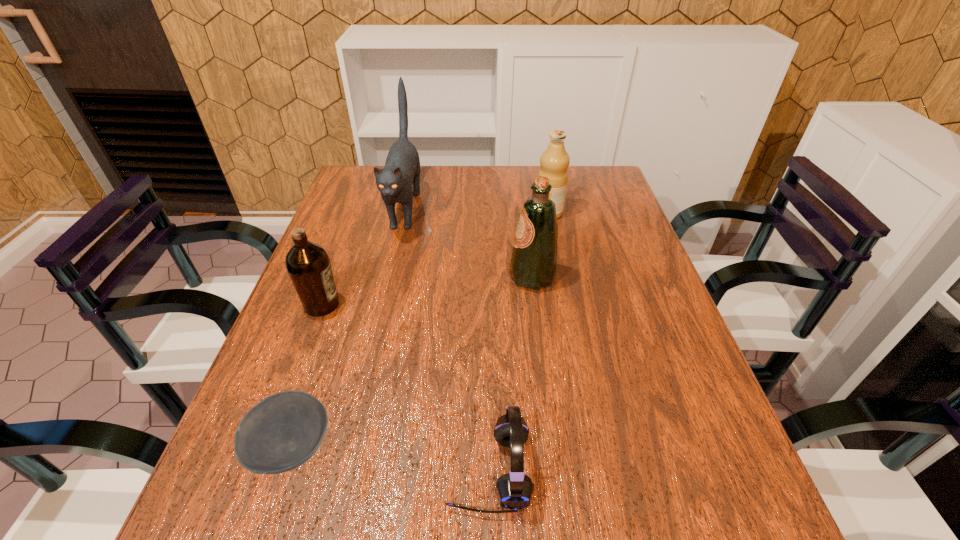
This screenshot has height=540, width=960. Find the location of `blank space located 0.320m on the label of the shortest olive oil`. blank space located 0.320m on the label of the shortest olive oil is located at coordinates pos(476,305).

Find the location of a particular element. The image size is (960, 540). free space located 0.270m on the ear cushions of the fifth tallest object is located at coordinates (289, 470).

Identify the location of blank space located 0.260m on the ear cushions of the fifth tallest object. (295, 470).

Where is `free location located on the ear cushions of the fifth tallest object`? The width and height of the screenshot is (960, 540). free location located on the ear cushions of the fifth tallest object is located at coordinates (419, 470).

At what (x,y) coordinates should I click in order to perform the action: click on vacant point located 0.260m on the right of the shortest object. Please return your answer as a coordinate pair (x, y). Looking at the image, I should click on (481, 447).

The height and width of the screenshot is (540, 960). I want to click on object that is at the far edge, so click(x=399, y=180).

This screenshot has width=960, height=540. In order to click on object that is positioned at the near edge in this screenshot , I will do `click(514, 490)`.

At what (x,y) coordinates should I click in order to perform the action: click on olive oil that is at the left edge. Please return your answer as a coordinate pair (x, y). This screenshot has height=540, width=960. Looking at the image, I should click on (308, 264).

Locate an element on the screen. The image size is (960, 540). bowl that is at the left edge is located at coordinates (283, 431).

In the image, there is a desktop. Where is `vacant space at the far edge`? The image size is (960, 540). vacant space at the far edge is located at coordinates (494, 186).